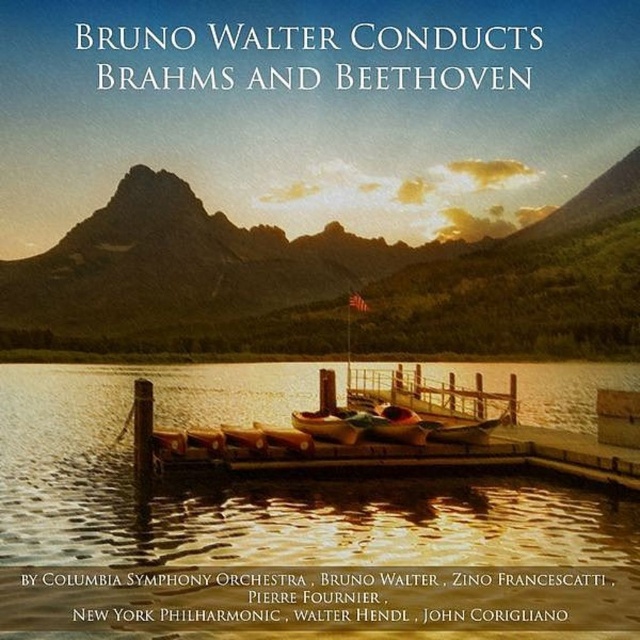
Question: Can you confirm if glistening water at dock center is positioned above green textured mountain at center?

Choices:
 (A) yes
 (B) no

Answer: (B)

Question: Does glistening water at dock center appear on the right side of green textured mountain at center?

Choices:
 (A) yes
 (B) no

Answer: (B)

Question: Does glistening water at dock center appear under green textured mountain at center?

Choices:
 (A) no
 (B) yes

Answer: (B)